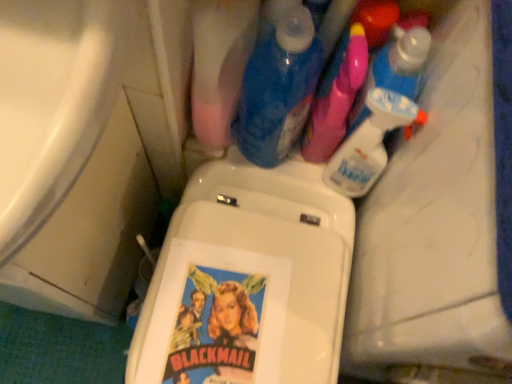
Question: From the image's perspective, is white glossy bathtub at lower left positioned above or below blue glossy bottle at upper center, acting as the 4th cleaning product starting from the right?

Choices:
 (A) below
 (B) above

Answer: (A)

Question: Based on their sizes in the image, would you say white glossy bathtub at lower left is bigger or smaller than blue glossy bottle at upper center, acting as the 4th cleaning product starting from the right?

Choices:
 (A) small
 (B) big

Answer: (B)

Question: Considering the real-world distances, which object is farthest from the translucent plastic spray bottle at upper right, positioned as the 1th cleaning product in right-to-left order?

Choices:
 (A) pink plastic spray bottle at upper right, the third cleaning product viewed from the right
 (B) blue glossy bottle at upper center, the first cleaning product positioned from the left
 (C) white glossy bathtub at lower left
 (D) clear plastic spray bottle at upper right, which appears as the 2th cleaning product when viewed from the right

Answer: (C)

Question: Estimate the real-world distances between objects in this image. Which object is closer to the pink plastic spray bottle at upper right, the third cleaning product viewed from the right?

Choices:
 (A) clear plastic spray bottle at upper right, the 3th cleaning product in the left-to-right sequence
 (B) white glossy bathtub at lower left
 (C) blue glossy bottle at upper center, the first cleaning product positioned from the left
 (D) translucent plastic spray bottle at upper right, positioned as the 1th cleaning product in right-to-left order

Answer: (D)